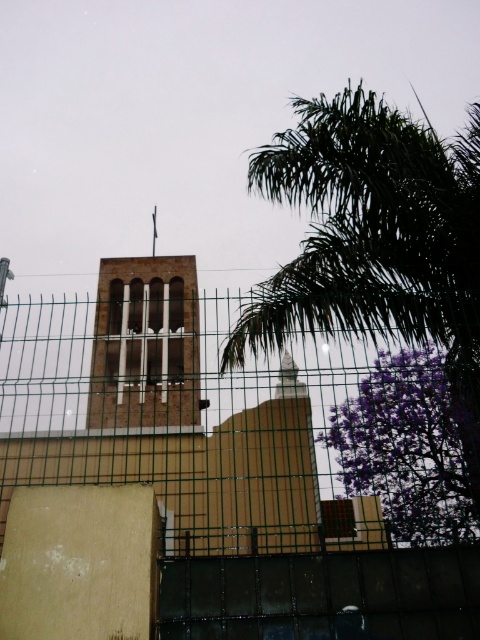
You are standing in front of the church and want to see the bell tower clearly. The green wire mesh fence at center and the purple leafy tree at right are blocking your view. Which object is shorter and would allow you to see over it?

The green wire mesh fence at center is not as tall as the purple leafy tree at right, so you can see over the green wire mesh fence at center.

You are standing in front of the church and notice two points marked on the building. One is at coordinate point (368,198) and the other at point (19,337). From your perspective, which point is closer to you?

Point (19,337) is closer to you because it is in front of point (368,198).

You are standing in front of the building and want to take a photo that includes both the purple leafy tree at right and the brown brick bell tower at center. Which object will appear narrower in the photo?

The purple leafy tree at right will appear narrower in the photo because it has a lesser width compared to the brown brick bell tower at center.